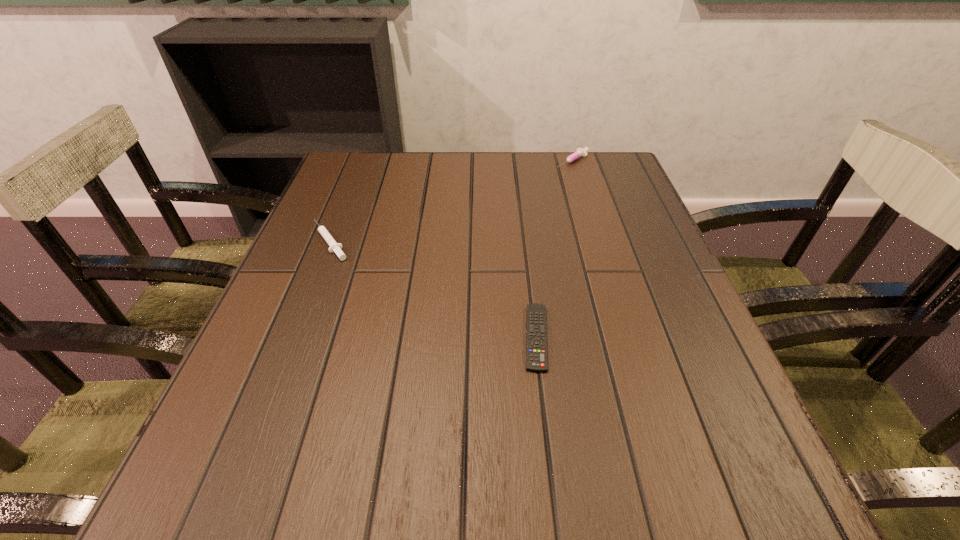
Where is `object that is the second closest to the second object from left to right`? The height and width of the screenshot is (540, 960). object that is the second closest to the second object from left to right is located at coordinates (580, 152).

The width and height of the screenshot is (960, 540). In order to click on vacant space that satisfies the following two spatial constraints: 1. on the back side of the farther syringe; 2. on the right side of the second shortest object in this screenshot , I will do `click(362, 161)`.

What are the coordinates of `vacant region that satisfies the following two spatial constraints: 1. on the back side of the leftmost object; 2. on the right side of the taller syringe` in the screenshot? It's located at (362, 161).

Where is `free spot that satisfies the following two spatial constraints: 1. on the back side of the nearer syringe; 2. on the right side of the right syringe`? free spot that satisfies the following two spatial constraints: 1. on the back side of the nearer syringe; 2. on the right side of the right syringe is located at coordinates (362, 161).